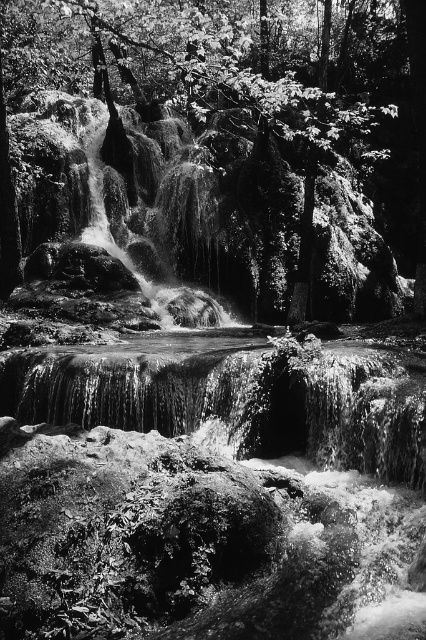
You are standing at the edge of the waterfall and see the translucent water at center and the smooth bark tree at upper center. Which object is closer to you?

The translucent water at center is closer to you because it is in front of the smooth bark tree at upper center.

You are a photographer planning to capture the waterfall scene. You notice the translucent water at center and the smooth bark tree at upper center. Which object should you focus on if you want to highlight the smaller one in your composition?

You should focus on the translucent water at center because it has a smaller size compared to the smooth bark tree at upper center.